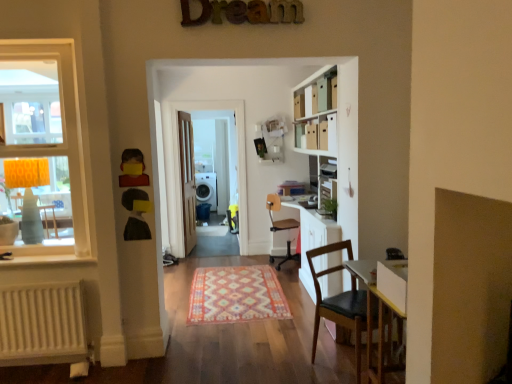
In order to click on vacant area on top of white matte radiator at lower left (from a real-world perspective) in this screenshot , I will do `click(38, 277)`.